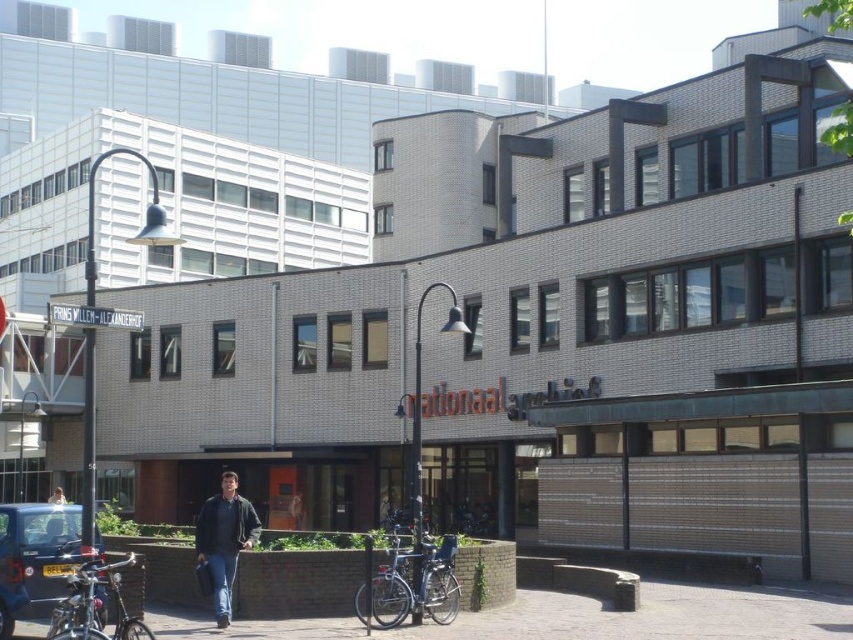
Is metallic silver car at lower left further to the viewer compared to dark blue jeans at center?

No, metallic silver car at lower left is closer to the viewer.

Which is behind, point (71, 563) or point (227, 532)?

Point (227, 532)

Who is more forward, (22, 541) or (219, 497)?

Point (22, 541)

You are a GUI agent. You are given a task and a screenshot of the screen. Output one action in this format:
    pyautogui.click(x=<x>, y=<y>)
    Task: Click on the metallic silver car at lower left
    The height and width of the screenshot is (640, 853).
    Given the screenshot: What is the action you would take?
    pyautogui.click(x=33, y=557)

Which is above, smooth concrete pavement at lower center or light blue jeans at center?

light blue jeans at center is above.

Can you confirm if smooth concrete pavement at lower center is bigger than light blue jeans at center?

No.

Measure the distance between point (x=299, y=636) and camera.

31.70 meters

You are a GUI agent. You are given a task and a screenshot of the screen. Output one action in this format:
    pyautogui.click(x=<x>, y=<y>)
    Task: Click on the smooth concrete pavement at lower center
    
    Given the screenshot: What is the action you would take?
    pyautogui.click(x=572, y=618)

How much distance is there between dark blue jeans at center and light blue jeans at center?

8.47 meters

Is dark blue jeans at center wider than light blue jeans at center?

Incorrect, dark blue jeans at center's width does not surpass light blue jeans at center's.

Measure the distance between point (202,556) and camera.

The distance of point (202,556) from camera is 34.16 meters.

I want to click on dark blue jeans at center, so click(x=224, y=540).